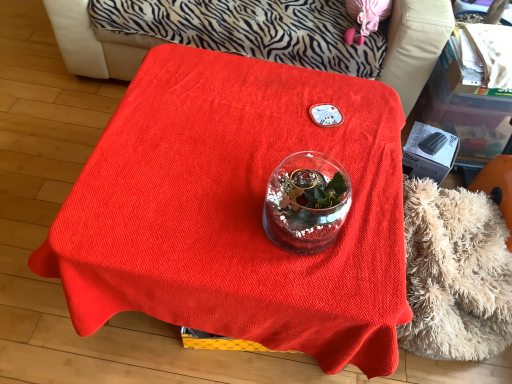
The image size is (512, 384). I want to click on unoccupied space behind transparent glass vase at center, so click(306, 158).